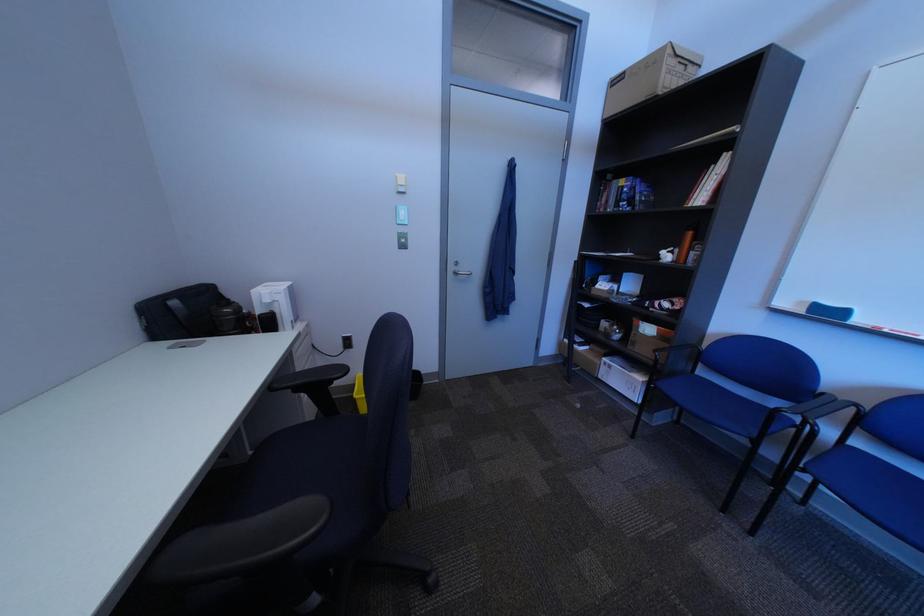
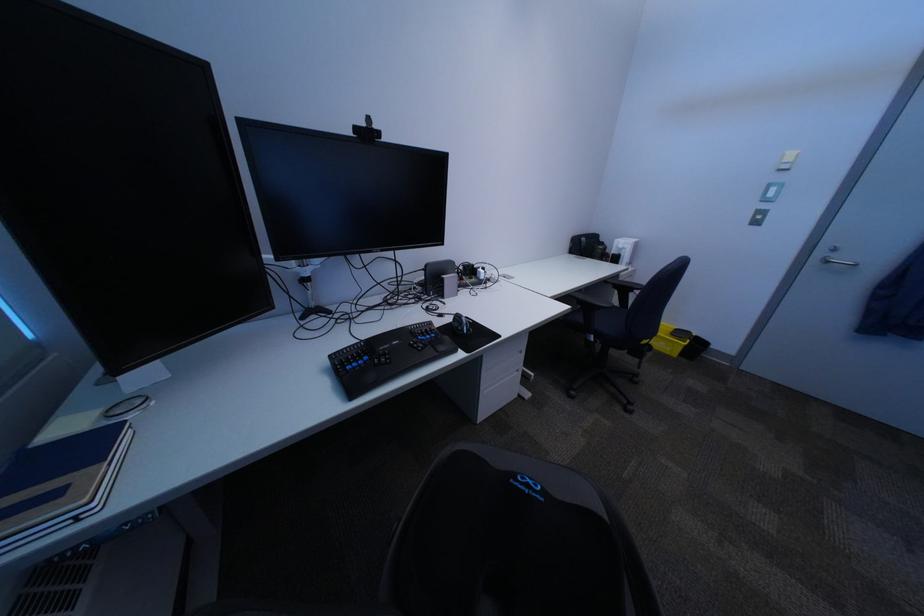
The point at (x=467, y=270) is marked in the first image. Where is the corresponding point in the second image?

(834, 254)